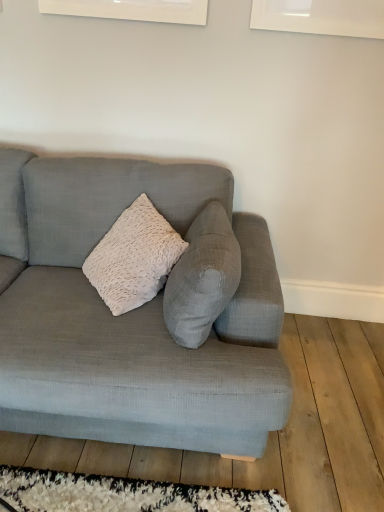
Locate an element on the screen. The height and width of the screenshot is (512, 384). vacant space situated above white shaggy rug at lower center (from a real-world perspective) is located at coordinates (127, 495).